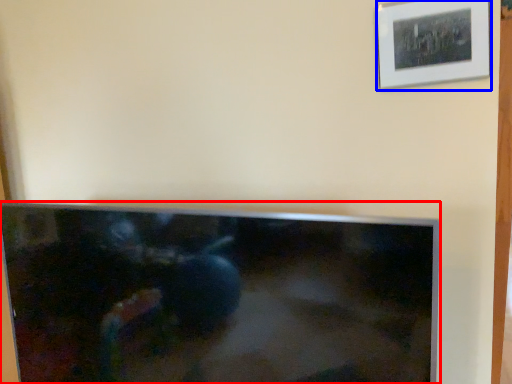
Question: Which of the following is the farthest to the observer, television (highlighted by a red box) or picture frame (highlighted by a blue box)?

Choices:
 (A) television
 (B) picture frame

Answer: (B)